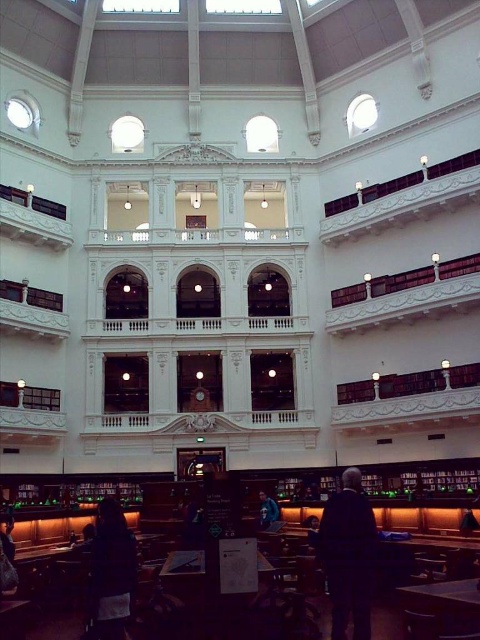
Is wooden table at lower right below dark blue fabric jacket at center?

No, wooden table at lower right is not below dark blue fabric jacket at center.

In the scene shown: Who is more distant from viewer, (x=453, y=609) or (x=276, y=506)?

→ Positioned behind is point (x=276, y=506).

Describe the element at coordinates (441, 609) in the screenshot. I see `wooden table at lower right` at that location.

I want to click on wooden table at lower right, so click(x=441, y=609).

Between dark suit at lower center and wooden table at lower right, which one appears on the right side from the viewer's perspective?

From the viewer's perspective, wooden table at lower right appears more on the right side.

Looking at this image, can you confirm if dark suit at lower center is shorter than wooden table at lower right?

In fact, dark suit at lower center may be taller than wooden table at lower right.

Locate an element on the screen. This screenshot has width=480, height=640. dark suit at lower center is located at coordinates (348, 556).

Where is `dark suit at lower center`? dark suit at lower center is located at coordinates (348, 556).

Does dark fabric jacket at lower left appear on the left side of wooden table at lower right?

Indeed, dark fabric jacket at lower left is positioned on the left side of wooden table at lower right.

Can you confirm if dark fabric jacket at lower left is positioned above wooden table at lower right?

Actually, dark fabric jacket at lower left is below wooden table at lower right.

Image resolution: width=480 pixels, height=640 pixels. What do you see at coordinates (110, 573) in the screenshot?
I see `dark fabric jacket at lower left` at bounding box center [110, 573].

Where is `dark fabric jacket at lower left`? dark fabric jacket at lower left is located at coordinates (110, 573).